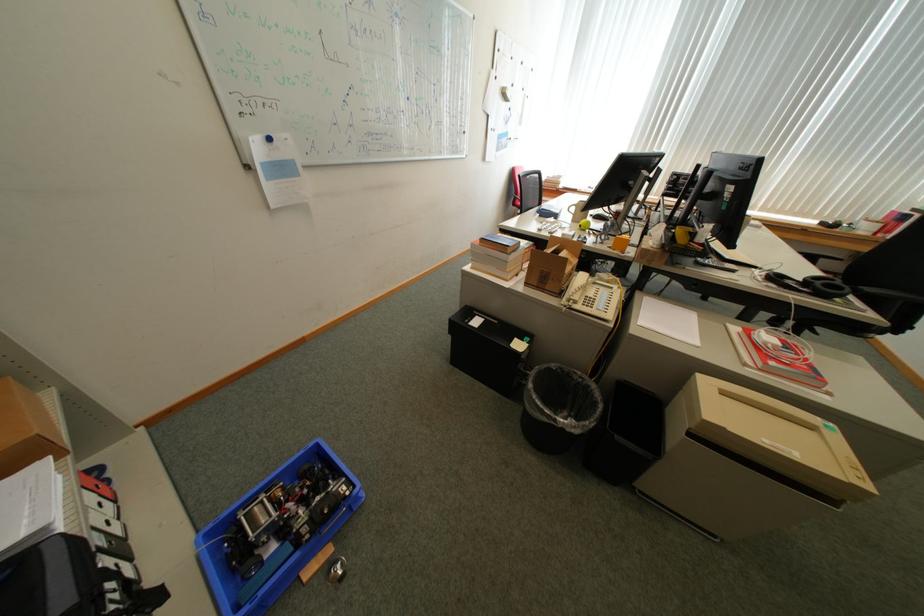
The image size is (924, 616). Identify the location of yellow mug. (619, 243).